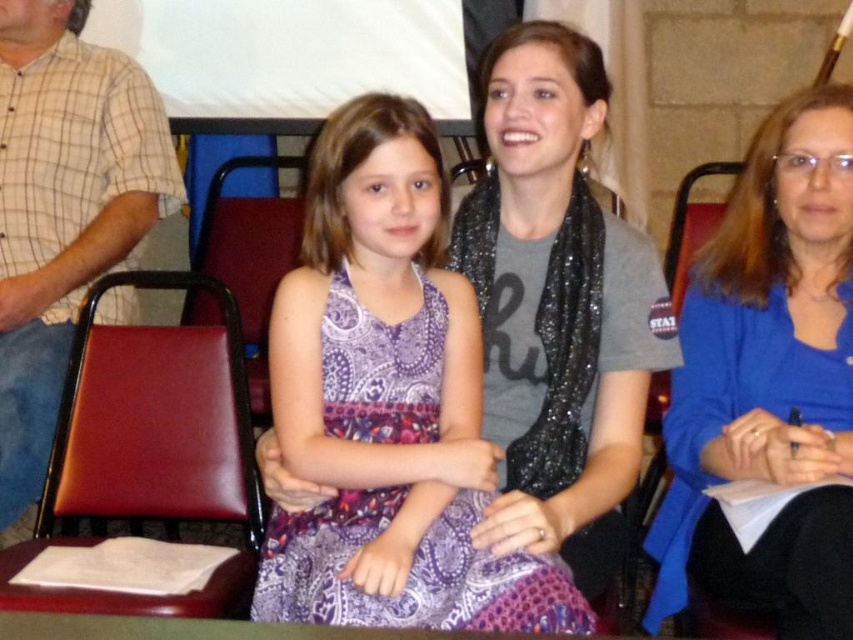
Question: Which object appears farthest from the camera in this image?

Choices:
 (A) leather at left
 (B) red leather chair at right
 (C) brown leather chair at center
 (D) purple paisley dress at center

Answer: (C)

Question: Does leather at left have a smaller size compared to red leather chair at right?

Choices:
 (A) yes
 (B) no

Answer: (A)

Question: Considering the relative positions of leather at left and red leather chair at right in the image provided, where is leather at left located with respect to red leather chair at right?

Choices:
 (A) left
 (B) right

Answer: (A)

Question: Which object is positioned farthest from the purple paisley dress at center?

Choices:
 (A) brown leather chair at center
 (B) red leather chair at right

Answer: (A)

Question: Which point is farther to the camera?

Choices:
 (A) (793, 538)
 (B) (86, 609)
 (C) (671, 276)

Answer: (C)

Question: Observing the image, what is the correct spatial positioning of blue fabric shirt at right in reference to brown leather chair at center?

Choices:
 (A) below
 (B) above

Answer: (A)